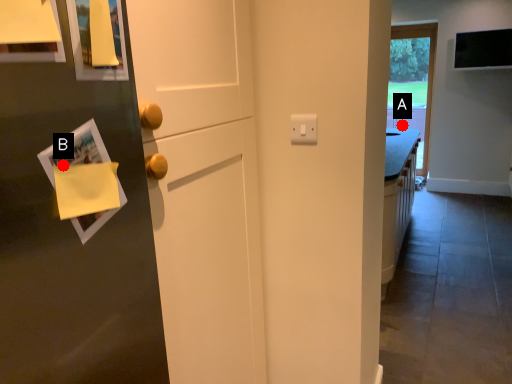
Question: Two points are circled on the image, labeled by A and B beside each circle. Among these points, which one is nearest to the camera?

Choices:
 (A) A is closer
 (B) B is closer

Answer: (B)